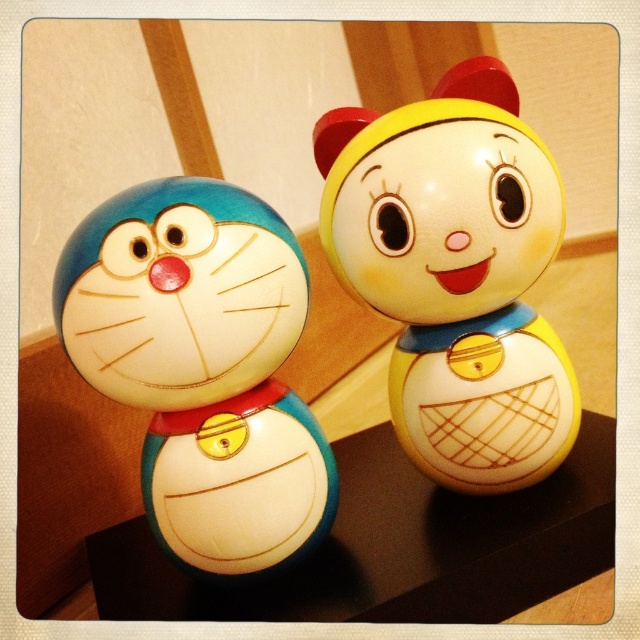
Question: In this image, where is glossy ceramic doll at upper right located relative to matte ceramic cat at left?

Choices:
 (A) above
 (B) below

Answer: (A)

Question: In this image, where is glossy ceramic doll at upper right located relative to matte ceramic cat at left?

Choices:
 (A) above
 (B) below

Answer: (A)

Question: Among these objects, which one is nearest to the camera?

Choices:
 (A) glossy ceramic doll at upper right
 (B) matte ceramic cat at left

Answer: (B)

Question: Does glossy ceramic doll at upper right have a larger size compared to matte ceramic cat at left?

Choices:
 (A) yes
 (B) no

Answer: (A)